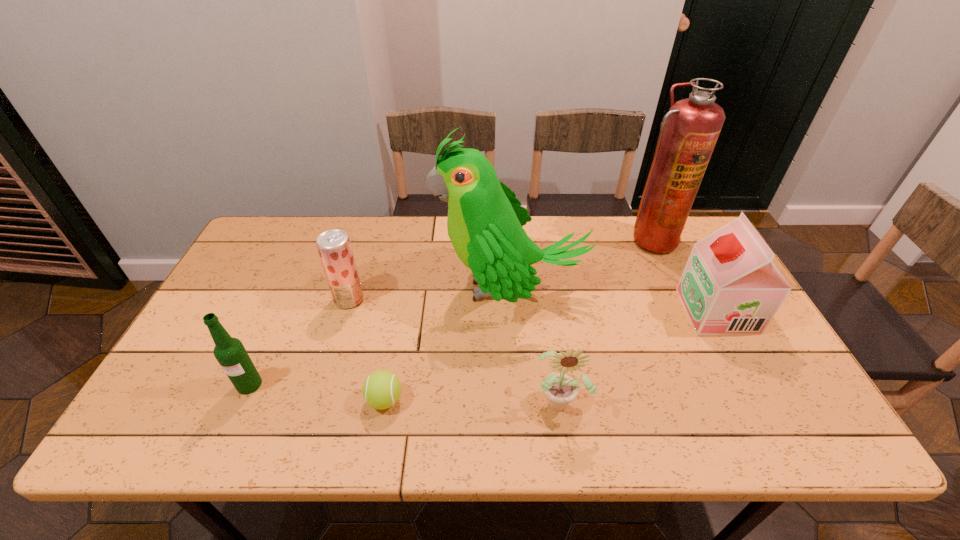
Identify the location of free space located on the beak of the parakeet. The width and height of the screenshot is (960, 540). (306, 288).

Where is `vacant space located on the beak of the parakeet`? The image size is (960, 540). vacant space located on the beak of the parakeet is located at coordinates (388, 288).

Where is `vacant space located with the cap open on the soya milk`? The width and height of the screenshot is (960, 540). vacant space located with the cap open on the soya milk is located at coordinates (588, 311).

Where is `vacant space located 0.330m with the cap open on the soya milk`? The height and width of the screenshot is (540, 960). vacant space located 0.330m with the cap open on the soya milk is located at coordinates (567, 311).

I want to click on free space located 0.240m with the cap open on the soya milk, so click(x=600, y=311).

At what (x,y) coordinates should I click in order to perform the action: click on blank space located 0.050m on the label of the beer bottle. Please return your answer as a coordinate pair (x, y). This screenshot has width=960, height=540. Looking at the image, I should click on (236, 415).

This screenshot has width=960, height=540. Identify the location of vacant space located 0.240m on the front of the sixth object from right to left. (324, 384).

Identify the location of free region located 0.070m on the back of the fifth object from right to left. point(392,360).

Identify the location of fire extinguisher that is at the far edge. (689, 131).

Where is `parakeet situated at the far edge`? The width and height of the screenshot is (960, 540). parakeet situated at the far edge is located at coordinates coord(485,220).